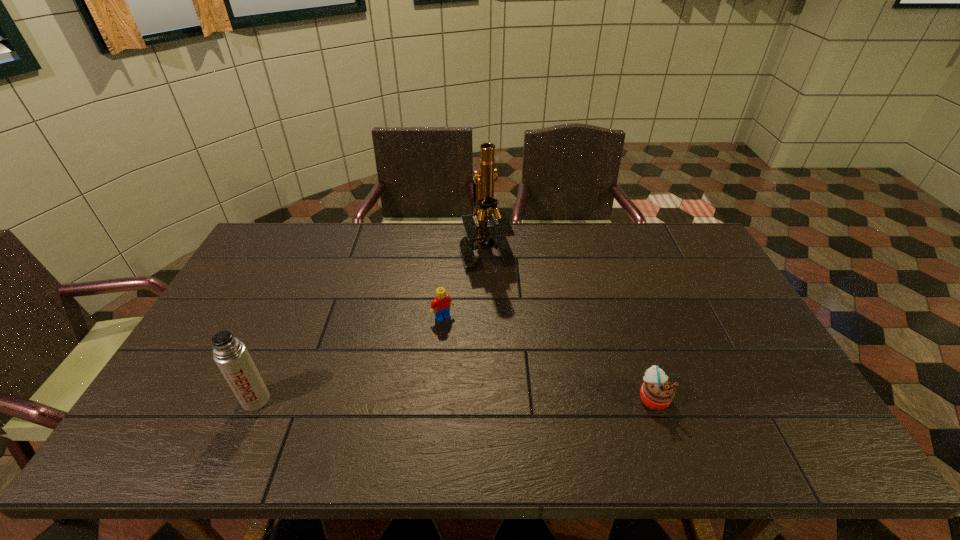
Image resolution: width=960 pixels, height=540 pixels. I want to click on free space at the left edge of the desktop, so click(x=268, y=313).

In order to click on free space at the right edge of the desktop in this screenshot , I will do `click(693, 265)`.

You are a GUI agent. You are given a task and a screenshot of the screen. Output one action in this format:
    pyautogui.click(x=<x>, y=<y>)
    Task: Click on the vacant space at the far left corner
    This screenshot has width=960, height=540.
    Given the screenshot: What is the action you would take?
    pyautogui.click(x=270, y=237)

The width and height of the screenshot is (960, 540). Find the location of `vacant space in between the microscope and the rightmost object`. vacant space in between the microscope and the rightmost object is located at coordinates (570, 323).

Identify the location of vacant area that lies between the thermos bottle and the Lego. (349, 359).

Find the location of a particular element. vacant point located between the Lego and the farthest object is located at coordinates (465, 284).

You are a GUI agent. You are given a task and a screenshot of the screen. Output one action in this format:
    pyautogui.click(x=<x>, y=<y>)
    Task: Click on the free space between the muffin and the farthest object
    Image resolution: width=960 pixels, height=540 pixels.
    Given the screenshot: What is the action you would take?
    pyautogui.click(x=570, y=323)

What are the coordinates of `free space that is in between the muffin and the leftmost object` in the screenshot? It's located at (454, 399).

Locate an element on the screen. empty space that is in between the microscope and the second object from left to right is located at coordinates (465, 284).

At what (x,y) coordinates should I click in order to perform the action: click on free space between the rightmost object and the second farthest object. Please return your answer as a coordinate pair (x, y). Looking at the image, I should click on (548, 357).